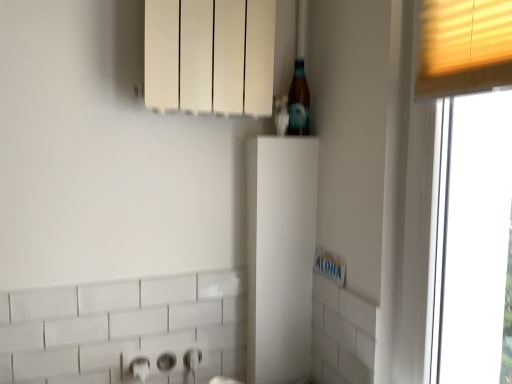
Question: From a real-world perspective, is translucent glass bottle at upper right over white matte cabinet at center, the second cabinetry when ordered from top to bottom?

Choices:
 (A) no
 (B) yes

Answer: (B)

Question: Considering the relative positions of translucent glass bottle at upper right and white matte cabinet at center, the second cabinetry when ordered from top to bottom, in the image provided, is translucent glass bottle at upper right to the right of white matte cabinet at center, the second cabinetry when ordered from top to bottom, from the viewer's perspective?

Choices:
 (A) yes
 (B) no

Answer: (A)

Question: Considering the relative sizes of translucent glass bottle at upper right and white matte cabinet at center, positioned as the 1th cabinetry in bottom-to-top order, in the image provided, is translucent glass bottle at upper right taller than white matte cabinet at center, positioned as the 1th cabinetry in bottom-to-top order,?

Choices:
 (A) yes
 (B) no

Answer: (B)

Question: Is translucent glass bottle at upper right bigger than white matte cabinet at center, positioned as the 1th cabinetry in bottom-to-top order?

Choices:
 (A) no
 (B) yes

Answer: (A)

Question: Is translucent glass bottle at upper right surrounding white matte cabinet at center, the second cabinetry when ordered from top to bottom?

Choices:
 (A) no
 (B) yes

Answer: (A)

Question: From the image's perspective, would you say translucent glass bottle at upper right is positioned over white matte cabinet at center, the second cabinetry when ordered from top to bottom?

Choices:
 (A) no
 (B) yes

Answer: (B)

Question: Does white matte radiator at upper center, placed as the second cabinetry when sorted from bottom to top, have a larger size compared to translucent glass bottle at upper right?

Choices:
 (A) no
 (B) yes

Answer: (B)

Question: Is white matte radiator at upper center, marked as the 1th cabinetry in a top-to-bottom arrangement, facing away from translucent glass bottle at upper right?

Choices:
 (A) yes
 (B) no

Answer: (A)

Question: Are white matte radiator at upper center, placed as the second cabinetry when sorted from bottom to top, and translucent glass bottle at upper right making contact?

Choices:
 (A) no
 (B) yes

Answer: (A)

Question: Would you consider white matte radiator at upper center, placed as the second cabinetry when sorted from bottom to top, to be distant from translucent glass bottle at upper right?

Choices:
 (A) no
 (B) yes

Answer: (A)

Question: Is white matte radiator at upper center, marked as the 1th cabinetry in a top-to-bottom arrangement, oriented towards translucent glass bottle at upper right?

Choices:
 (A) yes
 (B) no

Answer: (B)

Question: From a real-world perspective, is white matte radiator at upper center, placed as the second cabinetry when sorted from bottom to top, physically above translucent glass bottle at upper right?

Choices:
 (A) no
 (B) yes

Answer: (B)

Question: From a real-world perspective, is white matte radiator at upper center, marked as the 1th cabinetry in a top-to-bottom arrangement, positioned over white matte cabinet at center, positioned as the 1th cabinetry in bottom-to-top order, based on gravity?

Choices:
 (A) no
 (B) yes

Answer: (B)